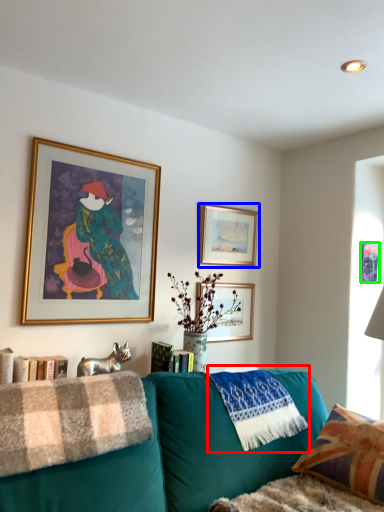
Question: Which object is positioned farthest from material (highlighted by a red box)? Select from picture frame (highlighted by a blue box) and picture frame (highlighted by a green box).

Choices:
 (A) picture frame
 (B) picture frame

Answer: (B)